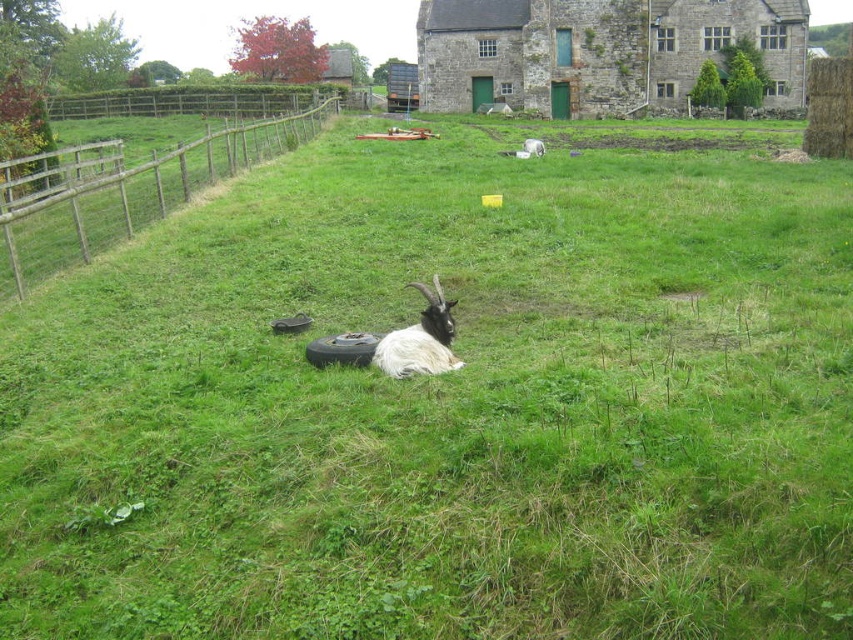
You are standing at the center of the grassy field and want to walk towards the brown wooden fence at left. What direction should you face to move directly towards it?

You should face towards the left direction to move directly towards the brown wooden fence at left since it is located at the left side of the field.

Looking at this image, you are a farmer checking the field. You need to know if the brown wooden fence at left is wider than the white fluffy goat at center. Can you confirm?

Answer: The brown wooden fence at left is wider than the white fluffy goat at center.

You are a farmer who needs to transport both the white fluffy goat at center and the white woolen sheep at center in a truck bed that can only accommodate animals up to 1.5 meters in width. Based on their sizes, will both animals fit side by side?

The white fluffy goat at center is wider than the white woolen sheep at center. However, since the truck bed can accommodate up to 1.5 meters, we need to know their exact widths. Unfortunately, the provided information only states that the goat is wider than the sheep but does not specify their exact measurements. Therefore, it is uncertain if both will fit side by side without additional information.